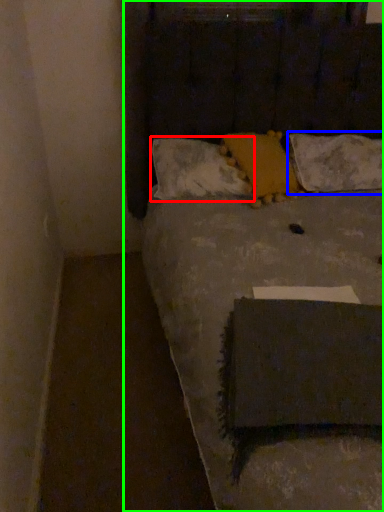
Question: Based on their relative distances, which object is nearer to pillow (highlighted by a red box)? Choose from pillow (highlighted by a blue box) and bed (highlighted by a green box).

Choices:
 (A) pillow
 (B) bed

Answer: (B)